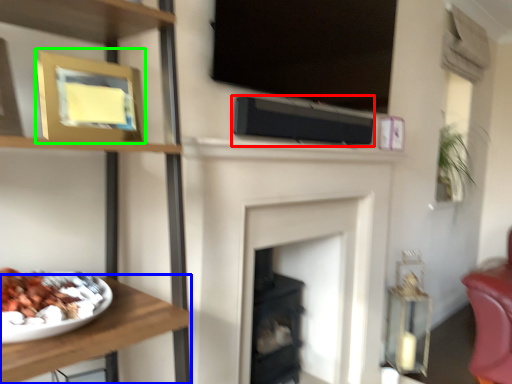
Question: Which object is the closest to the speaker (highlighted by a red box)? Choose among these: furniture (highlighted by a blue box) or picture frame (highlighted by a green box).

Choices:
 (A) furniture
 (B) picture frame

Answer: (B)